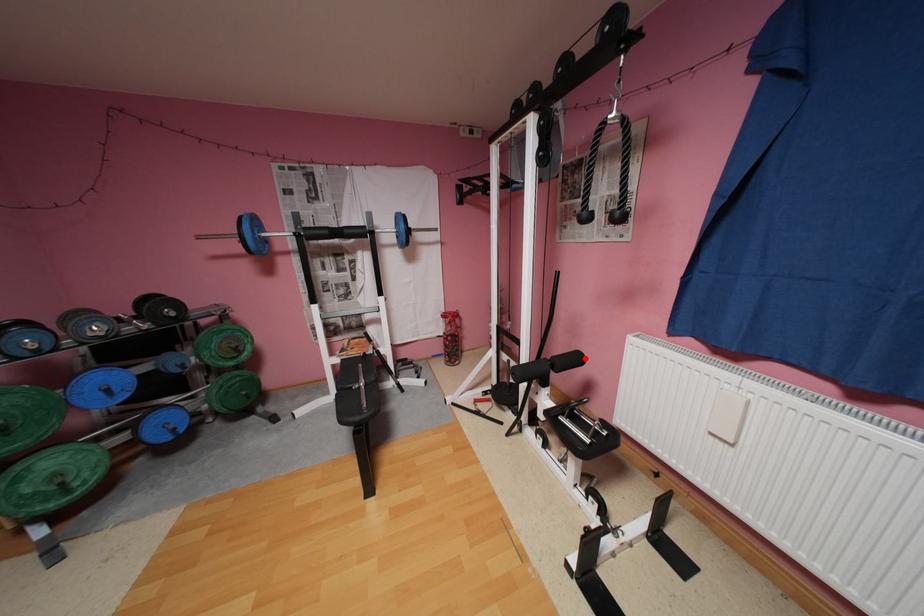
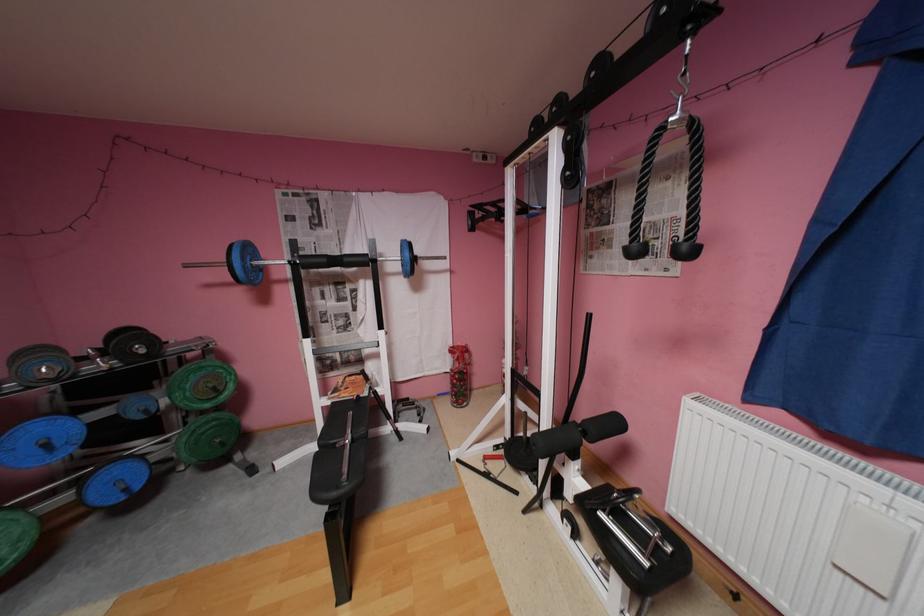
Locate, in the second image, the point that corresponds to the highlighted location in the first image.

(624, 424)